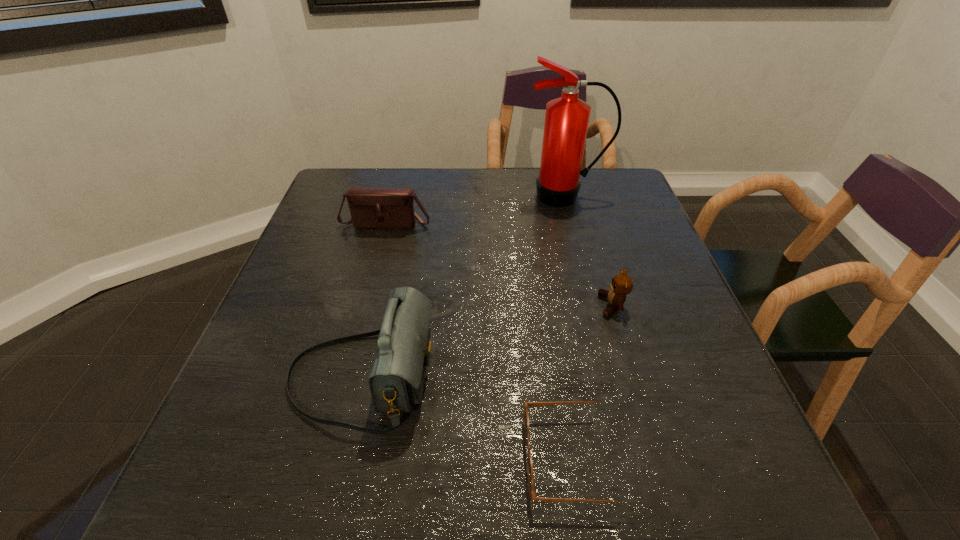
Identify the location of vacant space located on the right of the taller shoulder bag. (460, 377).

You are a GUI agent. You are given a task and a screenshot of the screen. Output one action in this format:
    pyautogui.click(x=<x>, y=<y>)
    Task: Click on the vacant space located 0.090m on the front flap of the fourth nearest object
    The image size is (960, 540).
    Given the screenshot: What is the action you would take?
    pyautogui.click(x=378, y=253)

Where is `vacant space located 0.130m on the front-facing side of the teddy bear`? The image size is (960, 540). vacant space located 0.130m on the front-facing side of the teddy bear is located at coordinates (540, 306).

You are a GUI agent. You are given a task and a screenshot of the screen. Output one action in this format:
    pyautogui.click(x=<x>, y=<y>)
    Task: Click on the free space located 0.140m on the front-facing side of the teddy bear
    This screenshot has width=960, height=540.
    Given the screenshot: What is the action you would take?
    pyautogui.click(x=536, y=306)

Find the location of a particular element. Image resolution: width=960 pixels, height=540 pixels. blank area located 0.280m on the front-facing side of the teddy bear is located at coordinates (473, 306).

The image size is (960, 540). In order to click on free space located on the front-facing side of the shortest object in this screenshot , I will do pyautogui.click(x=337, y=458).

I want to click on free space located 0.140m on the front-facing side of the shortest object, so click(x=441, y=458).

This screenshot has width=960, height=540. I want to click on free space located on the front-facing side of the shortest object, so click(410, 458).

The width and height of the screenshot is (960, 540). What are the coordinates of `object at the far edge` in the screenshot? It's located at (566, 123).

Where is `object present at the near edge`? The image size is (960, 540). object present at the near edge is located at coordinates click(x=531, y=482).